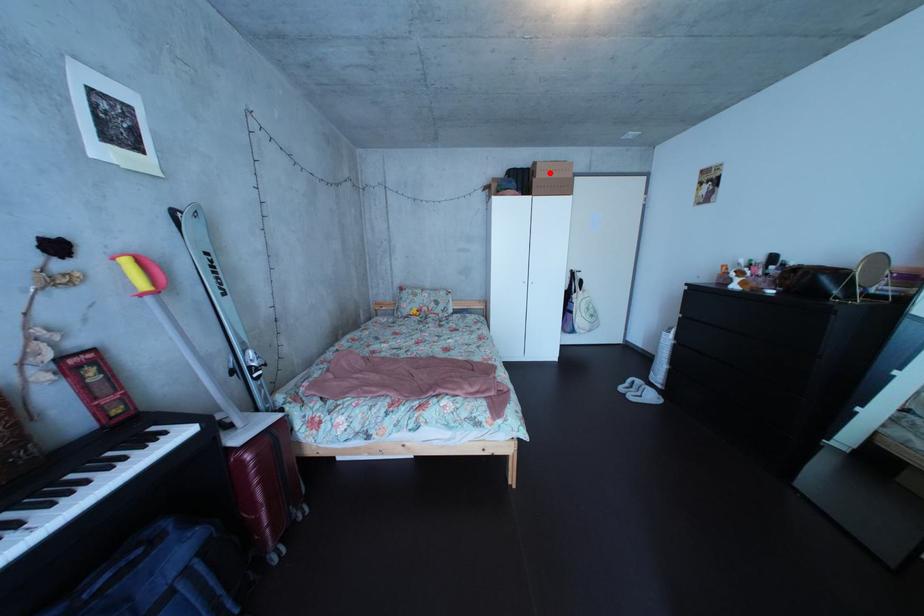
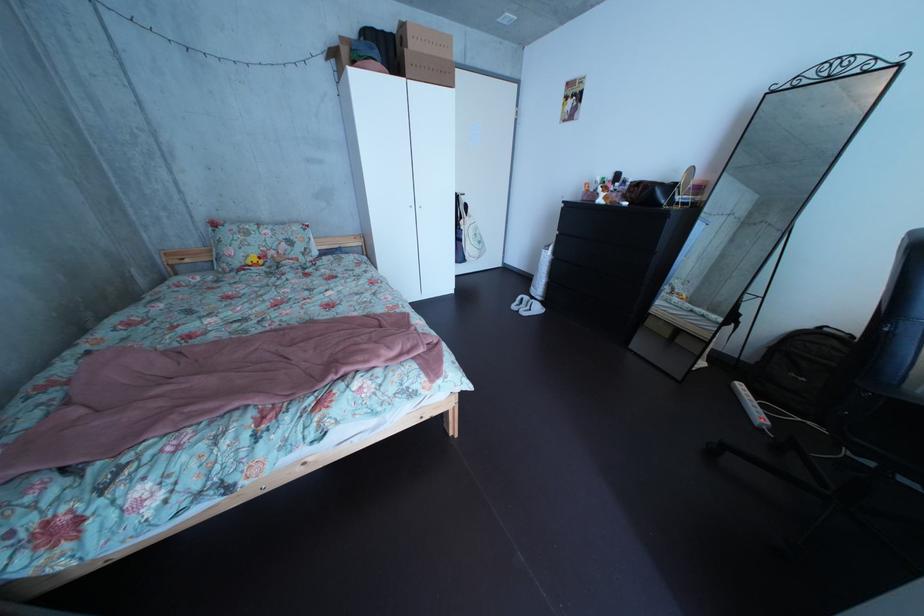
In the second image, find the point that corresponds to the highlighted location in the first image.

(418, 34)